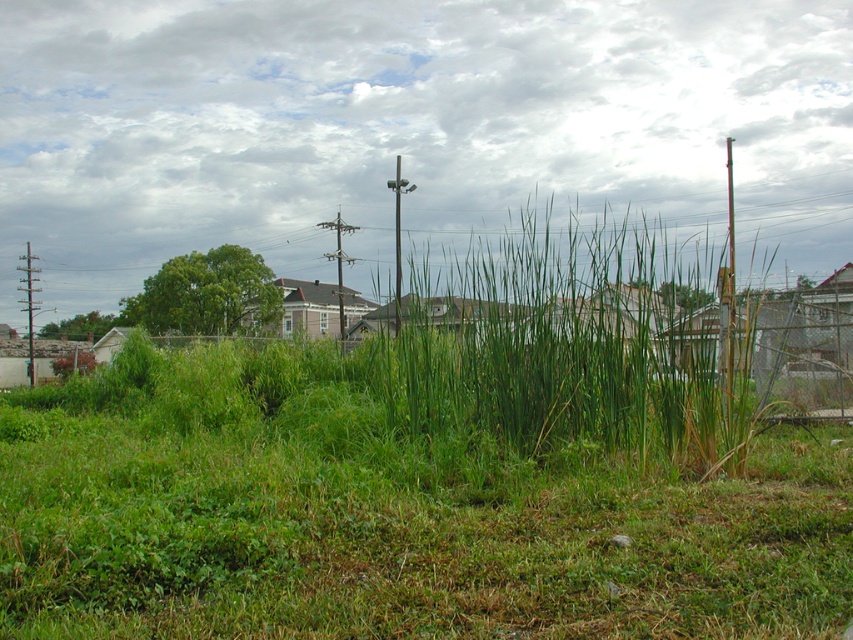
You are a bird flying over the overgrown area. You see the metallic gray telegraph pole at left and the brown wooden telegraph pole at center. Which pole would you land on first if you are flying straight towards them?

You would land on the metallic gray telegraph pole at left first because it is closer to you than the brown wooden telegraph pole at center.

You are a bird looking for a higher perch. You see the metallic gray telegraph pole at left and the metallic gray pole at center. Which pole should you choose?

The metallic gray pole at center is taller than the metallic gray telegraph pole at left, so you should choose the metallic gray pole at center for a higher perch.

You are a delivery drone that needs to navigate between two metallic gray poles in the scene. The metallic gray telegraph pole at left and the metallic gray pole at center are in your path. Which pole should you avoid flying to the right of to stay on course?

You should avoid flying to the right of the metallic gray telegraph pole at left because the metallic gray pole at center is to the right of it, so staying left would keep you on course.